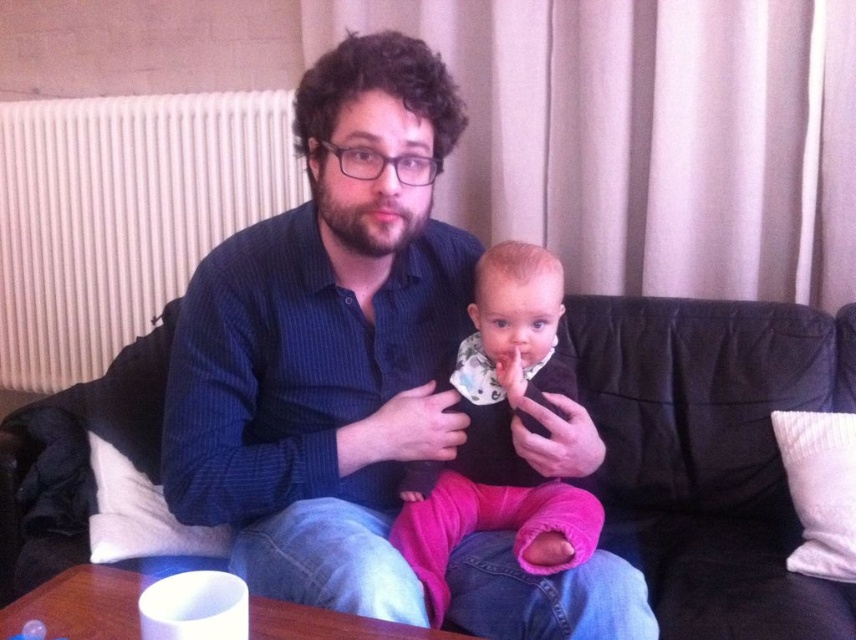
Does black leather couch at center lie behind pink fleece pants at center?

Yes, it is behind pink fleece pants at center.

Which is in front, point (851, 358) or point (578, 560)?

Positioned in front is point (578, 560).

Does point (727, 509) come behind point (545, 534)?

Yes, it is.

This screenshot has width=856, height=640. I want to click on black leather couch at center, so click(x=711, y=454).

Is blue striped shirt at center shorter than black leather couch at center?

No, blue striped shirt at center is not shorter than black leather couch at center.

Which is in front, point (385, 244) or point (687, 602)?

Positioned in front is point (385, 244).

You are a GUI agent. You are given a task and a screenshot of the screen. Output one action in this format:
    pyautogui.click(x=<x>, y=<y>)
    Task: Click on the blue striped shirt at center
    Image resolution: width=856 pixels, height=640 pixels.
    Given the screenshot: What is the action you would take?
    pyautogui.click(x=330, y=340)

Can you confirm if blue striped shirt at center is taller than pink fleece pants at center?

Yes, blue striped shirt at center is taller than pink fleece pants at center.

Between blue striped shirt at center and pink fleece pants at center, which one appears on the right side from the viewer's perspective?

From the viewer's perspective, pink fleece pants at center appears more on the right side.

Between point (488, 602) and point (444, 499), which one is positioned in front?

Point (488, 602) is in front.

You are a GUI agent. You are given a task and a screenshot of the screen. Output one action in this format:
    pyautogui.click(x=<x>, y=<y>)
    Task: Click on the blue striped shirt at center
    The width and height of the screenshot is (856, 640).
    Given the screenshot: What is the action you would take?
    pyautogui.click(x=330, y=340)